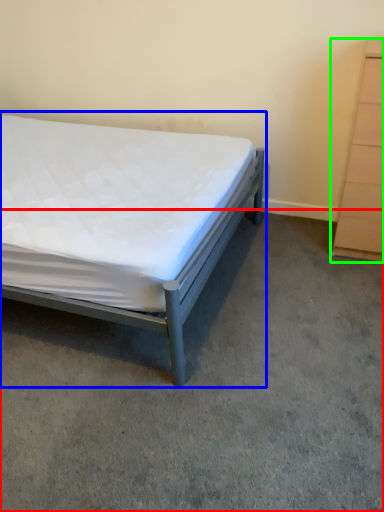
Question: Based on their relative distances, which object is nearer to concrete (highlighted by a red box)? Choose from bed (highlighted by a blue box) and chest of drawers (highlighted by a green box).

Choices:
 (A) bed
 (B) chest of drawers

Answer: (A)